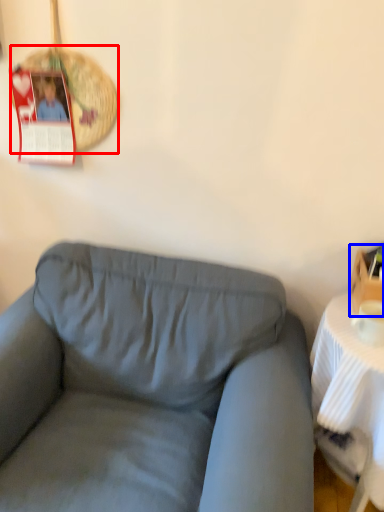
Question: Which of the following is the farthest to the observer, basket (highlighted by a red box) or box (highlighted by a blue box)?

Choices:
 (A) basket
 (B) box

Answer: (A)